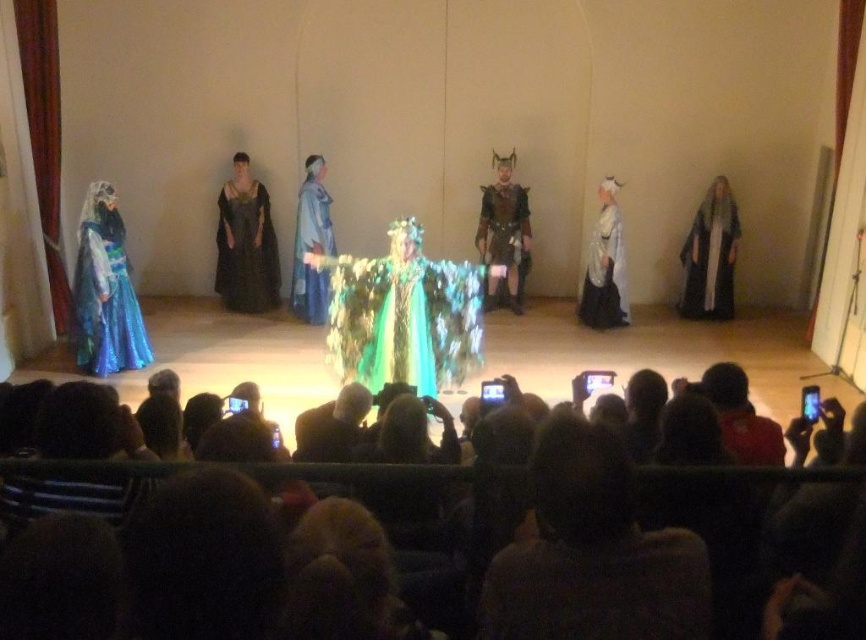
Consider the image. Between white silk robe at right and shiny blue fabric dress at center, which one appears on the right side from the viewer's perspective?

white silk robe at right is more to the right.

Is point (729, 205) positioned in front of point (296, 266)?

Yes.

The image size is (866, 640). Identify the location of white silk robe at right. (709, 253).

Is point (680, 616) behind point (606, 228)?

No.

What do you see at coordinates (592, 552) in the screenshot? I see `dark brown hair at lower center` at bounding box center [592, 552].

Who is more forward, (564, 516) or (598, 268)?

Positioned in front is point (564, 516).

Where is `dark brown hair at lower center`? The height and width of the screenshot is (640, 866). dark brown hair at lower center is located at coordinates (592, 552).

Which of these two, silky black hair at center or shiny blue gown at left, stands shorter?

With less height is silky black hair at center.

Does silky black hair at center have a larger size compared to shiny blue gown at left?

Incorrect, silky black hair at center is not larger than shiny blue gown at left.

The width and height of the screenshot is (866, 640). What do you see at coordinates (726, 522) in the screenshot?
I see `silky black hair at center` at bounding box center [726, 522].

Locate an element on the screen. The height and width of the screenshot is (640, 866). silky black hair at center is located at coordinates (726, 522).